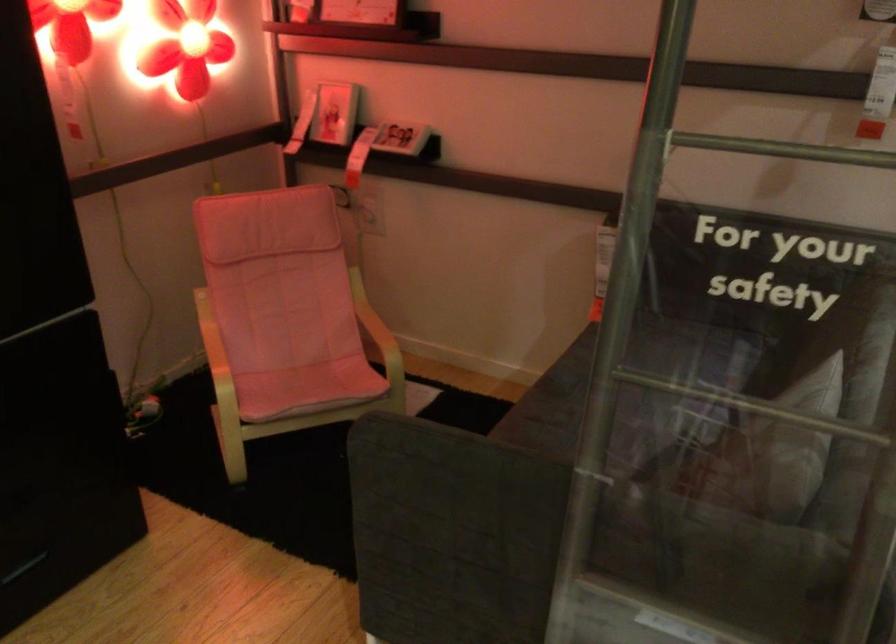
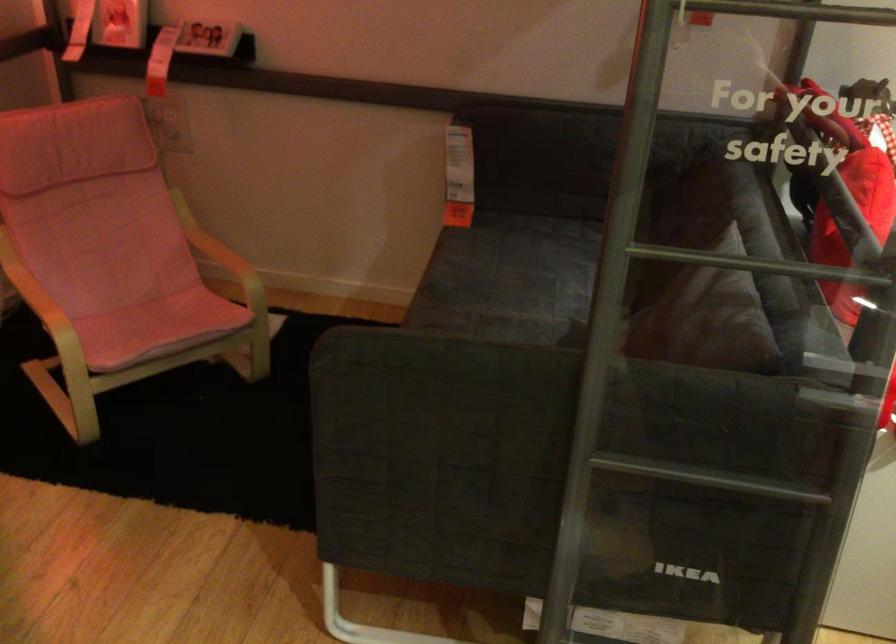
Locate, in the second image, the point that corresponds to (290,368) in the first image.

(126, 307)